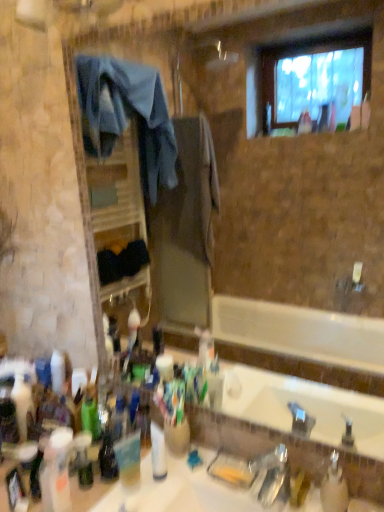
This screenshot has height=512, width=384. Describe the element at coordinates (83, 459) in the screenshot. I see `translucent plastic bottle at lower left, the second toiletry positioned from the right` at that location.

Describe the element at coordinates (334, 487) in the screenshot. I see `clear plastic bottle at lower right, arranged as the fifth bottle when viewed from the back` at that location.

What do you see at coordinates (299, 487) in the screenshot?
I see `yellow matte soap dispenser at lower right, the first toiletry viewed from the right` at bounding box center [299, 487].

This screenshot has height=512, width=384. I want to click on translucent plastic bottle at lower left, acting as the first toiletry starting from the left, so click(14, 488).

The image size is (384, 512). What do you see at coordinates (56, 471) in the screenshot?
I see `translucent plastic bottle at lower left, placed as the second bottle when sorted from front to back` at bounding box center [56, 471].

This screenshot has height=512, width=384. What do you see at coordinates (273, 475) in the screenshot? I see `metallic silver faucet at lower center` at bounding box center [273, 475].

You are a GUI agent. You are given a task and a screenshot of the screen. Output one action in this format:
    pyautogui.click(x=<x>, y=<y>)
    Task: Click on the translucent plastic bottle at lower left, the second toiletry positioned from the right
    This screenshot has width=384, height=512.
    Given the screenshot: What is the action you would take?
    pyautogui.click(x=83, y=459)

Considering the points (338, 504) and (183, 485), which point is in front, point (338, 504) or point (183, 485)?

Positioned in front is point (338, 504).

Locate an element on the screen. The image size is (384, 512). sink beneath the clear plastic bottle at lower right, positioned as the 1th bottle in right-to-left order (from a real-world perspective) is located at coordinates (192, 489).

Could you tell me if clear plastic bottle at lower right, placed as the first bottle when sorted from front to back, is facing white glossy sink at center?

No, clear plastic bottle at lower right, placed as the first bottle when sorted from front to back, is not aimed at white glossy sink at center.

Is white glossy sink at center a part of clear plastic bottle at lower right, arranged as the fifth bottle when viewed from the back?

No, clear plastic bottle at lower right, arranged as the fifth bottle when viewed from the back, does not contain white glossy sink at center.

From a real-world perspective, which object rests below the other?

white glossy sink at center, from a real-world perspective.

From the image's perspective, between white glossy bottle at center, positioned as the third bottle in front-to-back order, and white glossy sink at center, who is located below?

white glossy sink at center appears lower in the image.

Does white glossy bottle at center, which is the third bottle from back to front, turn towards white glossy sink at center?

No.

Which point is more distant from viewer, (x=120, y=475) or (x=331, y=453)?

The point (x=120, y=475) is farther from the camera.

Are translucent plastic cup at lower center and clear plastic bottle at lower right, arranged as the fifth bottle when viewed from the back, making contact?

translucent plastic cup at lower center is not next to clear plastic bottle at lower right, arranged as the fifth bottle when viewed from the back, and they're not touching.

Which object is further away from the camera taking this photo, translucent plastic cup at lower center or clear plastic bottle at lower right, placed as the first bottle when sorted from front to back?

translucent plastic cup at lower center is behind.

Looking at their sizes, would you say translucent plastic cup at lower center is wider or thinner than clear plastic bottle at lower right, positioned as the 1th bottle in right-to-left order?

Clearly, translucent plastic cup at lower center has less width compared to clear plastic bottle at lower right, positioned as the 1th bottle in right-to-left order.

Is yellow matte soap dispenser at lower right, the 3th toiletry from the left, not near metallic silver faucet at lower center?

Actually, yellow matte soap dispenser at lower right, the 3th toiletry from the left, and metallic silver faucet at lower center are a little close together.

Is yellow matte soap dispenser at lower right, the first toiletry viewed from the right, oriented towards metallic silver faucet at lower center?

No.

From the picture: Can you tell me how much yellow matte soap dispenser at lower right, the first toiletry viewed from the right, and metallic silver faucet at lower center differ in facing direction?

The angular difference between yellow matte soap dispenser at lower right, the first toiletry viewed from the right, and metallic silver faucet at lower center is 1.22 degrees.

Is translucent plastic bottle at lower left, the third bottle when ordered from right to left, shorter than translucent plastic bottle at lower left, which is counted as the third toiletry, starting from the right?

No, translucent plastic bottle at lower left, the third bottle when ordered from right to left, is not shorter than translucent plastic bottle at lower left, which is counted as the third toiletry, starting from the right.

Is translucent plastic bottle at lower left, marked as the third bottle in a left-to-right arrangement, at the left side of translucent plastic bottle at lower left, which is counted as the third toiletry, starting from the right?

Incorrect, translucent plastic bottle at lower left, marked as the third bottle in a left-to-right arrangement, is not on the left side of translucent plastic bottle at lower left, which is counted as the third toiletry, starting from the right.

Which of these two, translucent plastic bottle at lower left, marked as the third bottle in a left-to-right arrangement, or translucent plastic bottle at lower left, acting as the first toiletry starting from the left, is thinner?

Thinner between the two is translucent plastic bottle at lower left, acting as the first toiletry starting from the left.

From the image's perspective, which one is positioned lower, translucent plastic bottle at lower left, which is the 2th bottle in back-to-front order, or translucent plastic bottle at lower left, which is counted as the third toiletry, starting from the right?

translucent plastic bottle at lower left, which is counted as the third toiletry, starting from the right, appears lower in the image.

From a real-world perspective, is translucent plastic bottle at lower left, the second toiletry positioned from the right, beneath clear plastic bottle at lower right, arranged as the fifth bottle when viewed from the back?

Correct, in the physical world, translucent plastic bottle at lower left, the second toiletry positioned from the right, is lower than clear plastic bottle at lower right, arranged as the fifth bottle when viewed from the back.

From the image's perspective, is translucent plastic bottle at lower left, the second toiletry from the left, above or below clear plastic bottle at lower right, which appears as the 5th bottle when viewed from the left?

translucent plastic bottle at lower left, the second toiletry from the left, is situated lower than clear plastic bottle at lower right, which appears as the 5th bottle when viewed from the left, in the image.

Considering the sizes of objects translucent plastic bottle at lower left, the second toiletry positioned from the right, and clear plastic bottle at lower right, positioned as the 1th bottle in right-to-left order, in the image provided, who is shorter, translucent plastic bottle at lower left, the second toiletry positioned from the right, or clear plastic bottle at lower right, positioned as the 1th bottle in right-to-left order,?

translucent plastic bottle at lower left, the second toiletry positioned from the right, is shorter.

Which point is more distant from viewer, (115, 471) or (83, 444)?

Positioned behind is point (83, 444).

Is translucent plastic bottle at lower left, the 4th bottle viewed from the front, wider than translucent plastic bottle at lower left, the second toiletry from the left?

Yes, translucent plastic bottle at lower left, the 4th bottle viewed from the front, is wider than translucent plastic bottle at lower left, the second toiletry from the left.

Considering the relative sizes of translucent plastic bottle at lower left, marked as the third bottle in a left-to-right arrangement, and translucent plastic bottle at lower left, the second toiletry from the left, in the image provided, is translucent plastic bottle at lower left, marked as the third bottle in a left-to-right arrangement, bigger than translucent plastic bottle at lower left, the second toiletry from the left,?

Yes.

Can you see translucent plastic bottle at lower left, the third bottle when ordered from right to left, touching translucent plastic bottle at lower left, the second toiletry positioned from the right?

Yes, translucent plastic bottle at lower left, the third bottle when ordered from right to left, is touching translucent plastic bottle at lower left, the second toiletry positioned from the right.

Where is `bottle that is the 1st one when counting backward from the white glossy sink at center`? This screenshot has height=512, width=384. bottle that is the 1st one when counting backward from the white glossy sink at center is located at coordinates (334, 487).

Locate an element on the screen. The width and height of the screenshot is (384, 512). sink on the right of white glossy bottle at center, the fourth bottle in the left-to-right sequence is located at coordinates (192, 489).

When comparing their distances from yellow matte soap dispenser at lower right, the 3th toiletry from the left, does clear plastic bottle at lower right, placed as the first bottle when sorted from front to back, or translucent plastic bottle at lower left, which is counted as the third toiletry, starting from the right, seem closer?

Based on the image, clear plastic bottle at lower right, placed as the first bottle when sorted from front to back, appears to be nearer to yellow matte soap dispenser at lower right, the 3th toiletry from the left.

Looking at this image, which object lies further to the anchor point translucent plastic bottle at lower left, which is counted as the third toiletry, starting from the right, translucent plastic bottle at lower left, the third bottle when ordered from right to left, or white glossy bottle at center, the fourth bottle in the left-to-right sequence?

The object further to translucent plastic bottle at lower left, which is counted as the third toiletry, starting from the right, is white glossy bottle at center, the fourth bottle in the left-to-right sequence.

Based on their spatial positions, is yellow matte soap dispenser at lower right, the first toiletry viewed from the right, or green matte bottle at lower left, arranged as the 2th bottle when viewed from the left, further from translucent plastic bottle at lower left, positioned as the 4th bottle in back-to-front order?

The object further to translucent plastic bottle at lower left, positioned as the 4th bottle in back-to-front order, is yellow matte soap dispenser at lower right, the first toiletry viewed from the right.

In the scene shown: Estimate the real-world distances between objects in this image. Which object is closer to translucent plastic bottle at lower left, the second toiletry from the left, white glossy sink at center or metallic silver faucet at lower center?

white glossy sink at center.

Looking at the image, which one is located closer to clear plastic bottle at lower right, placed as the first bottle when sorted from front to back, translucent plastic bottle at lower left, which is the 2th bottle in back-to-front order, or yellow matte soap dispenser at lower right, the 3th toiletry from the left?

yellow matte soap dispenser at lower right, the 3th toiletry from the left, is closer to clear plastic bottle at lower right, placed as the first bottle when sorted from front to back.

Looking at the image, which one is located closer to yellow matte soap dispenser at lower right, the first toiletry viewed from the right, translucent plastic bottle at lower left, acting as the first toiletry starting from the left, or translucent plastic bottle at lower left, the 1th bottle in the left-to-right sequence?

Based on the image, translucent plastic bottle at lower left, the 1th bottle in the left-to-right sequence, appears to be nearer to yellow matte soap dispenser at lower right, the first toiletry viewed from the right.

Based on their spatial positions, is clear plastic bottle at lower right, which appears as the 5th bottle when viewed from the left, or white glossy bottle at center, the 2th bottle positioned from the right, further from translucent plastic bottle at lower left, marked as the third bottle in a left-to-right arrangement?

clear plastic bottle at lower right, which appears as the 5th bottle when viewed from the left, is further to translucent plastic bottle at lower left, marked as the third bottle in a left-to-right arrangement.

When comparing their distances from translucent plastic cup at lower center, does translucent plastic bottle at lower left, the 1th bottle in the left-to-right sequence, or yellow matte soap dispenser at lower right, the 3th toiletry from the left, seem further?

The object further to translucent plastic cup at lower center is yellow matte soap dispenser at lower right, the 3th toiletry from the left.

This screenshot has width=384, height=512. What are the coordinates of `coffee cup located between translucent plastic bottle at lower left, acting as the first toiletry starting from the left, and yellow matte soap dispenser at lower right, the 3th toiletry from the left, in the left-right direction` in the screenshot? It's located at (129, 460).

I want to click on sink between translucent plastic cup at lower center and yellow matte soap dispenser at lower right, the first toiletry viewed from the right, in the horizontal direction, so coord(192,489).

This screenshot has height=512, width=384. What are the coordinates of `faucet located between white glossy bottle at center, the fourth bottle in the left-to-right sequence, and clear plastic bottle at lower right, arranged as the fifth bottle when viewed from the back, in the left-right direction` in the screenshot? It's located at (273, 475).

Find the location of a particular element. This screenshot has height=512, width=384. toiletry between translucent plastic bottle at lower left, acting as the first toiletry starting from the left, and white glossy sink at center, in the horizontal direction is located at coordinates click(x=83, y=459).